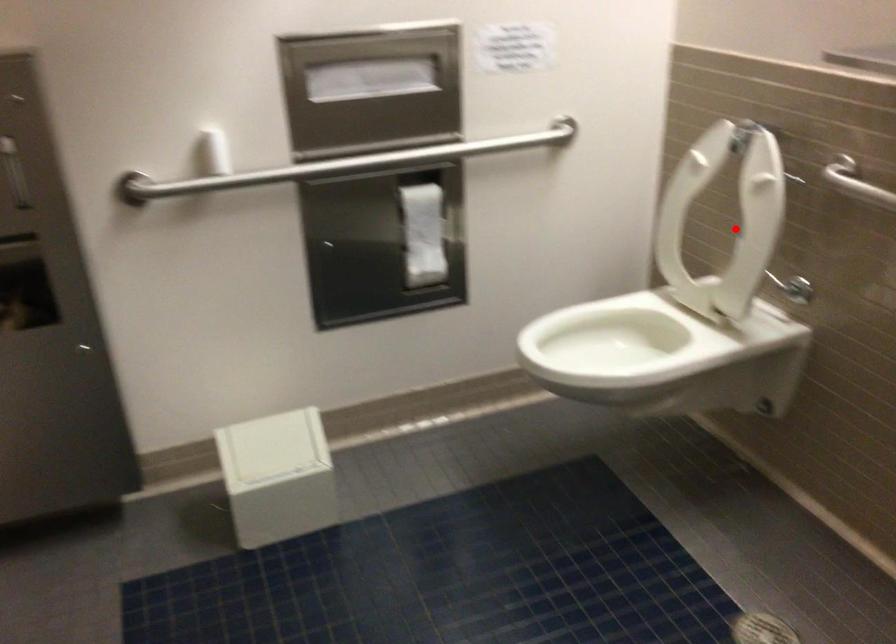
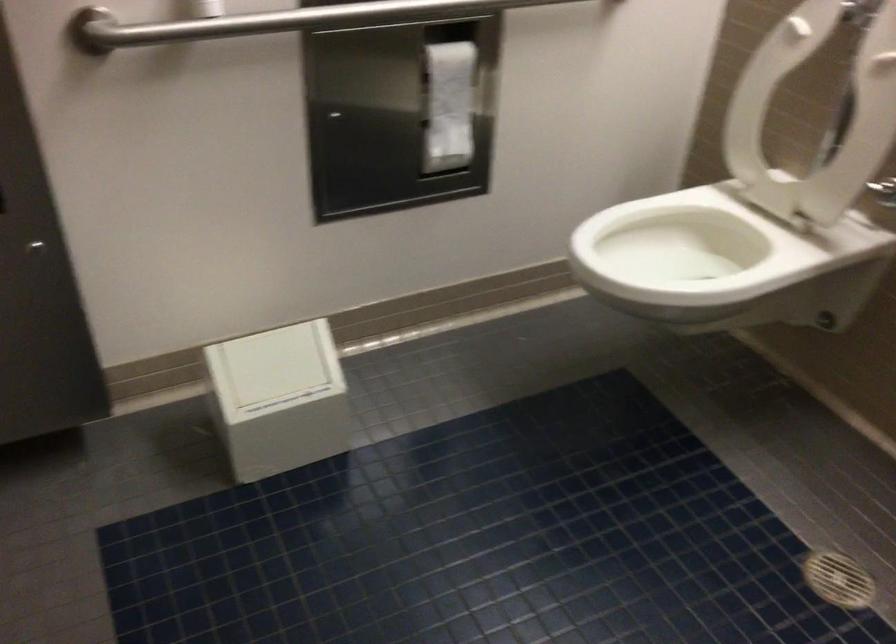
The point at the highlighted location is marked in the first image. Where is the corresponding point in the second image?

(814, 115)